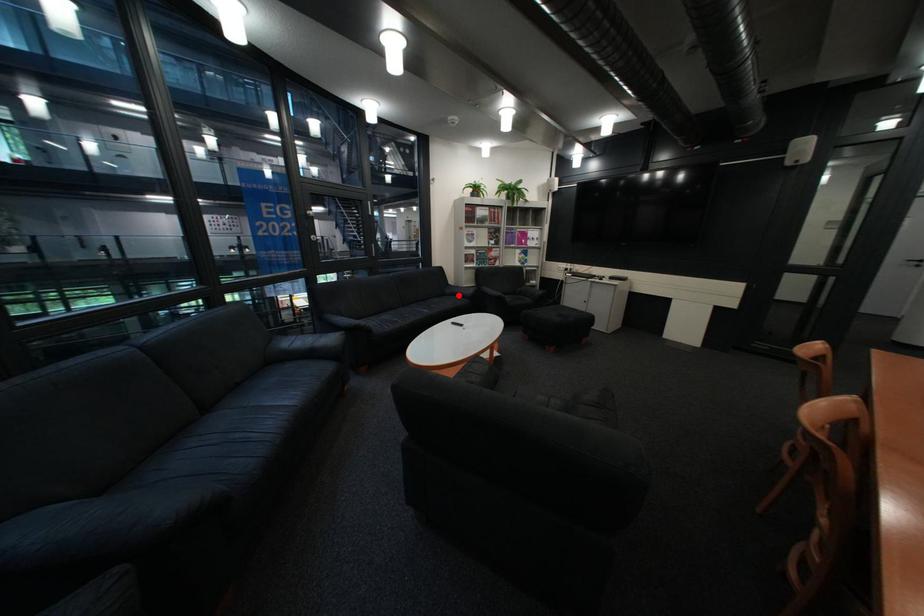
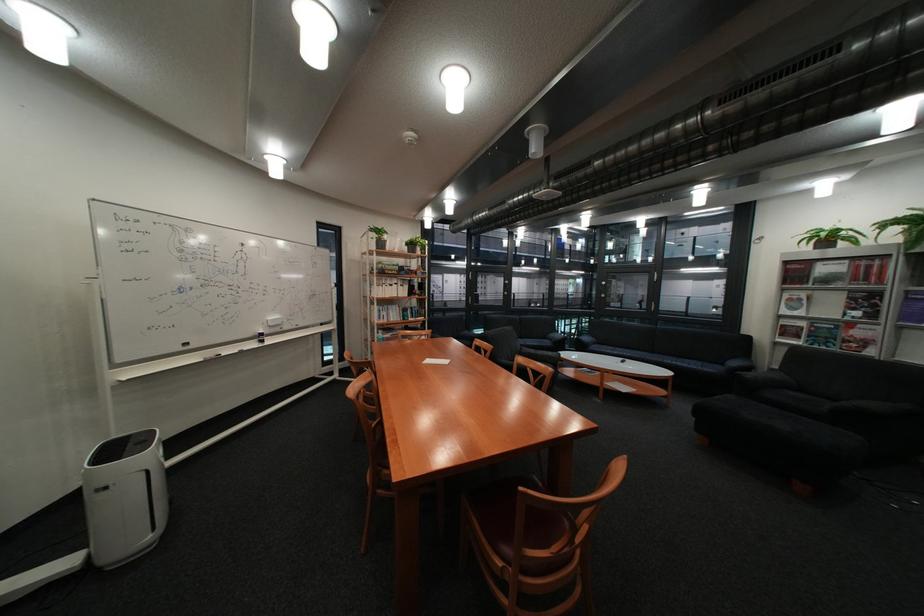
Find the pixel in the second image that matches the highlighted location in the first image.

(737, 363)